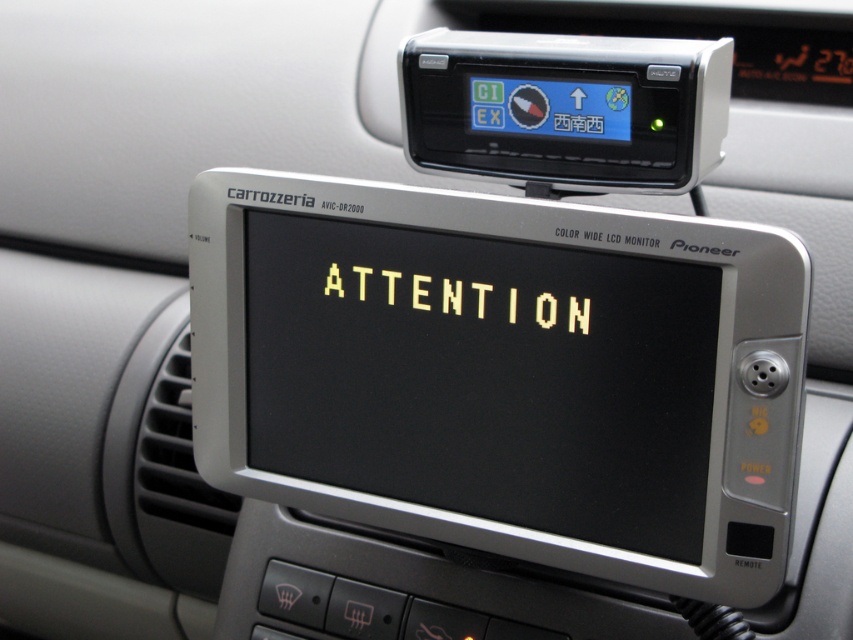
Question: Which point is closer to the camera taking this photo?

Choices:
 (A) 567,83
 (B) 460,310

Answer: (A)

Question: Is black plastic gps at upper center smaller than yellow pixelated text at center?

Choices:
 (A) yes
 (B) no

Answer: (B)

Question: Which point is farther to the camera?

Choices:
 (A) black plastic gps at upper center
 (B) yellow pixelated text at center

Answer: (B)

Question: Is black plastic gps at upper center positioned in front of yellow pixelated text at center?

Choices:
 (A) yes
 (B) no

Answer: (A)

Question: Can you confirm if black plastic gps at upper center is positioned below yellow pixelated text at center?

Choices:
 (A) no
 (B) yes

Answer: (A)

Question: Which point appears farthest from the camera in this image?

Choices:
 (A) (549, 152)
 (B) (338, 291)

Answer: (B)